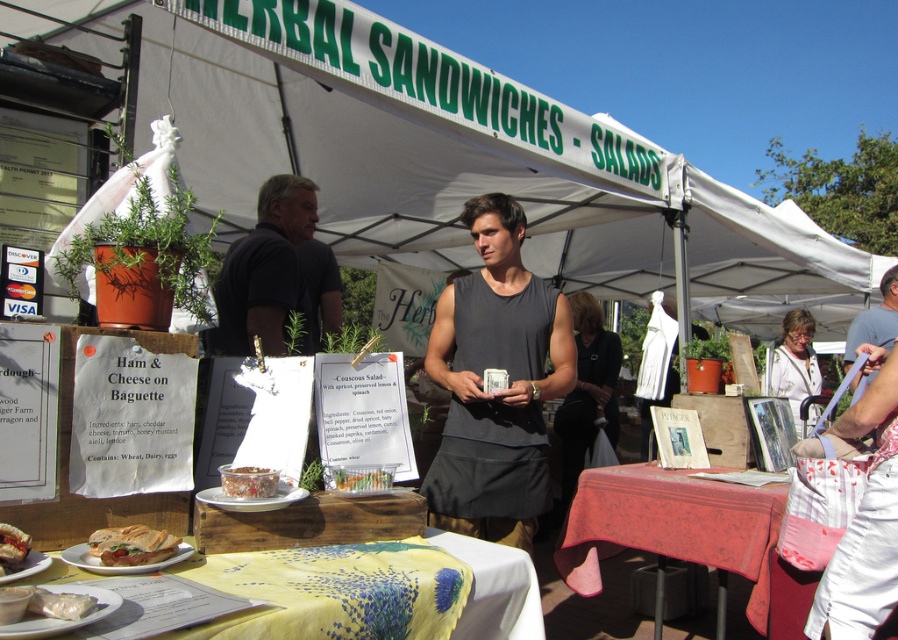
You are a customer at the market and want to buy the black fabric dress represented by point (x=587, y=390). Where should you look in the image?

The black fabric dress represented by point (x=587, y=390) is located at the center of the image.